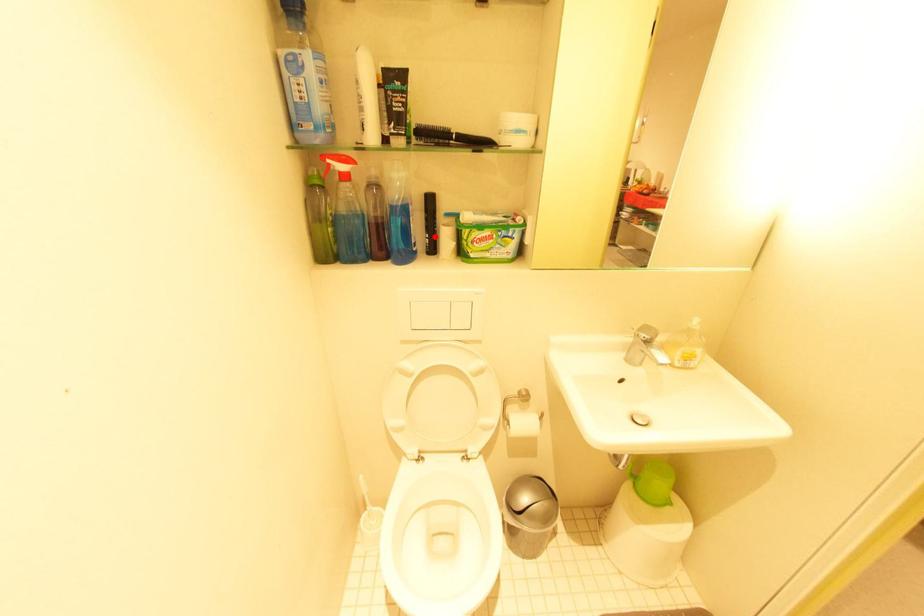
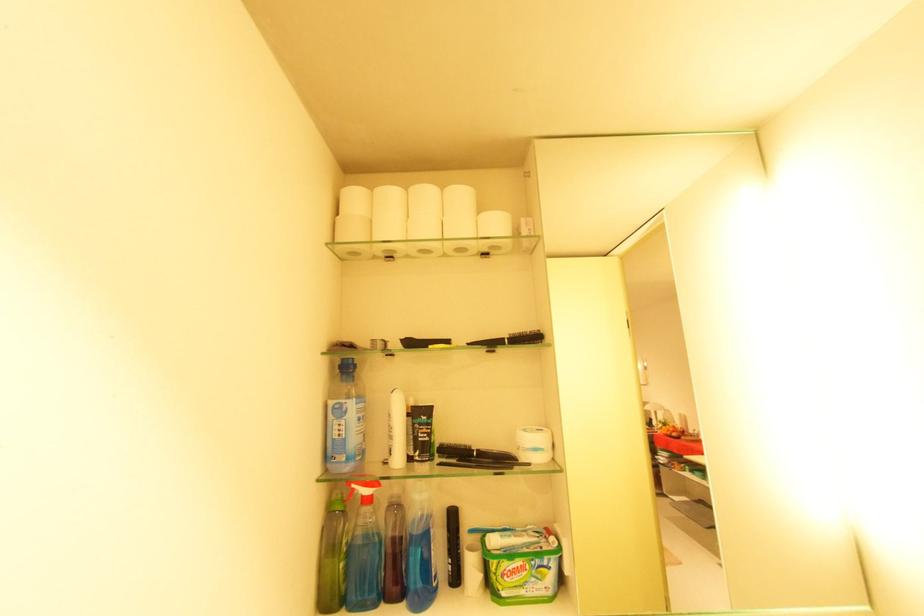
Locate, in the second image, the point that corresponds to the highlighted location in the first image.

(457, 562)